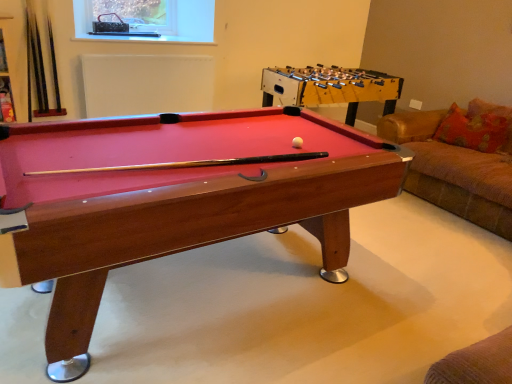
In order to face wooden foosball table at center, should I rotate leftwards or rightwards?

Turn right approximately 9.045 degrees to face it.

The image size is (512, 384). I want to click on metallic mesh at upper center, so click(146, 20).

Locate an element on the screen. This screenshot has height=384, width=512. table located underneath the metallic mesh at upper center (from a real-world perspective) is located at coordinates (330, 88).

Would you say wooden foosball table at center is a long distance from metallic mesh at upper center?

That's right, there is a large distance between wooden foosball table at center and metallic mesh at upper center.

Is wooden foosball table at center facing towards metallic mesh at upper center?

No, wooden foosball table at center is not turned towards metallic mesh at upper center.

Between point (291, 86) and point (209, 17), which one is positioned in front?

Positioned in front is point (291, 86).

Would you say metallic mesh at upper center is to the left or to the right of wooden foosball table at center in the picture?

Clearly, metallic mesh at upper center is on the left of wooden foosball table at center in the image.

Would you say metallic mesh at upper center is outside wooden foosball table at center?

metallic mesh at upper center lies outside wooden foosball table at center's area.

Measure the distance between metallic mesh at upper center and wooden foosball table at center.

A distance of 1.25 meters exists between metallic mesh at upper center and wooden foosball table at center.

Between metallic mesh at upper center and wooden foosball table at center, which one has smaller width?

With smaller width is metallic mesh at upper center.

From their relative heights in the image, would you say white matte ball at center is taller or shorter than metallic mesh at upper center?

In the image, white matte ball at center appears to be shorter than metallic mesh at upper center.

Does white matte ball at center turn towards metallic mesh at upper center?

No.

From the image's perspective, between white matte ball at center and metallic mesh at upper center, which one is located above?

metallic mesh at upper center.

Considering the sizes of objects white matte ball at center and metallic mesh at upper center in the image provided, who is thinner, white matte ball at center or metallic mesh at upper center?

With smaller width is white matte ball at center.

Can you confirm if metallic mesh at upper center is smaller than wooden billiard table at center?

Yes.

Is metallic mesh at upper center oriented away from wooden billiard table at center?

No, metallic mesh at upper center is not facing the opposite direction of wooden billiard table at center.

From a real-world perspective, who is located higher, metallic mesh at upper center or wooden billiard table at center?

metallic mesh at upper center.

Does metallic mesh at upper center appear on the left side of wooden billiard table at center?

Indeed, metallic mesh at upper center is positioned on the left side of wooden billiard table at center.

From the image's perspective, is wooden foosball table at center on orange fabric pillow at right?

Yes, from the image's perspective, wooden foosball table at center is above orange fabric pillow at right.

Is point (353, 123) farther from viewer compared to point (476, 116)?

Yes, point (353, 123) is behind point (476, 116).

How far apart are wooden foosball table at center and orange fabric pillow at right?

95.22 centimeters.

Looking at this image, choose the correct answer: Is wooden foosball table at center inside orange fabric pillow at right or outside it?

wooden foosball table at center is located beyond the bounds of orange fabric pillow at right.

Which of these two, wooden billiard table at center or orange fabric pillow at right, stands taller?

wooden billiard table at center.

Looking at this image, is orange fabric pillow at right at the back of wooden billiard table at center?

That's not correct — wooden billiard table at center is not looking away from orange fabric pillow at right.

There is a wooden billiard table at center. Identify the location of pillow above it (from a real-world perspective). (477, 127).

Between wooden billiard table at center and orange fabric pillow at right, which one has larger size?

With larger size is wooden billiard table at center.

How far apart are wooden foosball table at center and wooden billiard table at center?

wooden foosball table at center and wooden billiard table at center are 1.81 meters apart.

From the image's perspective, is wooden foosball table at center located beneath wooden billiard table at center?

Incorrect, from the image's perspective, wooden foosball table at center is higher than wooden billiard table at center.

Can you tell me how much wooden foosball table at center and wooden billiard table at center differ in facing direction?

2.32 degrees separate the facing orientations of wooden foosball table at center and wooden billiard table at center.

Which object is positioned more to the right, wooden foosball table at center or wooden billiard table at center?

wooden foosball table at center is more to the right.

You are a GUI agent. You are given a task and a screenshot of the screen. Output one action in this format:
    pyautogui.click(x=<x>, y=<y>)
    Task: Click on the window screen located behind the wooden foosball table at center
    Image resolution: width=512 pixels, height=384 pixels.
    Given the screenshot: What is the action you would take?
    pyautogui.click(x=146, y=20)

In the image, there is a wooden foosball table at center. Identify the location of window screen above it (from the image's perspective). The height and width of the screenshot is (384, 512). (146, 20).

Estimate the real-world distances between objects in this image. Which object is further from orange fabric pillow at right, wooden billiard table at center or metallic mesh at upper center?

Among the two, metallic mesh at upper center is located further to orange fabric pillow at right.

Which object lies nearer to the anchor point wooden billiard table at center, metallic mesh at upper center or wooden foosball table at center?

wooden foosball table at center is closer to wooden billiard table at center.

From the image, which object appears to be nearer to metallic mesh at upper center, orange fabric pillow at right or wooden foosball table at center?

Among the two, wooden foosball table at center is located nearer to metallic mesh at upper center.

Estimate the real-world distances between objects in this image. Which object is closer to wooden billiard table at center, wooden foosball table at center or orange fabric pillow at right?

The object closer to wooden billiard table at center is wooden foosball table at center.

Considering their positions, is wooden foosball table at center positioned closer to orange fabric pillow at right than metallic mesh at upper center?

wooden foosball table at center is positioned closer to the anchor orange fabric pillow at right.

Which object lies nearer to the anchor point orange fabric pillow at right, wooden billiard table at center or white matte ball at center?

The object closer to orange fabric pillow at right is white matte ball at center.

Considering their positions, is orange fabric pillow at right positioned further to metallic mesh at upper center than white matte ball at center?

white matte ball at center is further to metallic mesh at upper center.

Estimate the real-world distances between objects in this image. Which object is further from wooden billiard table at center, metallic mesh at upper center or orange fabric pillow at right?

metallic mesh at upper center is positioned further to the anchor wooden billiard table at center.

At what (x,y) coordinates should I click in order to perform the action: click on billiard table situated between metallic mesh at upper center and orange fabric pillow at right from left to right. Please return your answer as a coordinate pair (x, y). The width and height of the screenshot is (512, 384). Looking at the image, I should click on (174, 198).

Locate an element on the screen. ball between metallic mesh at upper center and wooden foosball table at center is located at coordinates (297, 142).

Where is `table situated between white matte ball at center and orange fabric pillow at right from left to right`? This screenshot has height=384, width=512. table situated between white matte ball at center and orange fabric pillow at right from left to right is located at coordinates (330, 88).

You are a GUI agent. You are given a task and a screenshot of the screen. Output one action in this format:
    pyautogui.click(x=<x>, y=<y>)
    Task: Click on the pillow positioned between wooden billiard table at center and wooden foosball table at center from near to far
    Image resolution: width=512 pixels, height=384 pixels.
    Given the screenshot: What is the action you would take?
    pyautogui.click(x=477, y=127)